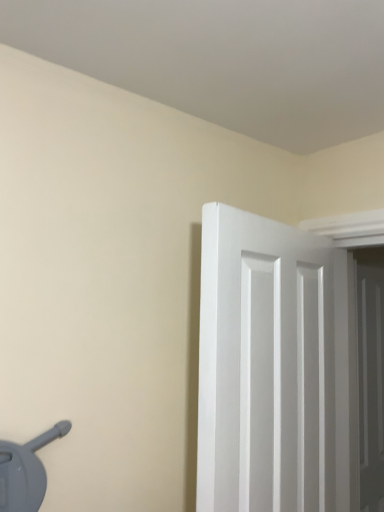
Question: Does white wooden door at right, acting as the 2th door starting from the left, have a smaller size compared to white smooth door at right, the second door viewed from the right?

Choices:
 (A) yes
 (B) no

Answer: (A)

Question: Is white wooden door at right, positioned as the first door in back-to-front order, completely or partially outside of white smooth door at right, which is the first door from left to right?

Choices:
 (A) yes
 (B) no

Answer: (A)

Question: Can you see white wooden door at right, acting as the 2th door starting from the left, touching white smooth door at right, the first door from the front?

Choices:
 (A) no
 (B) yes

Answer: (A)

Question: Can you confirm if white wooden door at right, the first door from the right, is thinner than white smooth door at right, which is the first door from left to right?

Choices:
 (A) no
 (B) yes

Answer: (B)

Question: From a real-world perspective, is white wooden door at right, acting as the 2th door starting from the left, on top of white smooth door at right, the first door from the front?

Choices:
 (A) yes
 (B) no

Answer: (B)

Question: Is white wooden door at right, positioned as the first door in back-to-front order, further to the viewer compared to white smooth door at right, the second door in the back-to-front sequence?

Choices:
 (A) yes
 (B) no

Answer: (A)

Question: Is white smooth door at right, the second door viewed from the right, facing away from white wooden door at right, positioned as the first door in back-to-front order?

Choices:
 (A) yes
 (B) no

Answer: (B)

Question: From a real-world perspective, is white smooth door at right, the second door viewed from the right, physically below white wooden door at right, positioned as the first door in back-to-front order?

Choices:
 (A) yes
 (B) no

Answer: (B)

Question: Considering the relative sizes of white smooth door at right, the second door in the back-to-front sequence, and white wooden door at right, which is the 2th door in front-to-back order, in the image provided, is white smooth door at right, the second door in the back-to-front sequence, bigger than white wooden door at right, which is the 2th door in front-to-back order,?

Choices:
 (A) no
 (B) yes

Answer: (B)

Question: From a real-world perspective, is white smooth door at right, the second door viewed from the right, physically above white wooden door at right, positioned as the first door in back-to-front order?

Choices:
 (A) no
 (B) yes

Answer: (B)

Question: Is white smooth door at right, the first door from the front, positioned behind white wooden door at right, which is the 2th door in front-to-back order?

Choices:
 (A) no
 (B) yes

Answer: (A)

Question: Considering the relative sizes of white smooth door at right, the first door from the front, and white wooden door at right, positioned as the first door in back-to-front order, in the image provided, is white smooth door at right, the first door from the front, shorter than white wooden door at right, positioned as the first door in back-to-front order,?

Choices:
 (A) yes
 (B) no

Answer: (A)

Question: From a real-world perspective, is white wooden door at right, acting as the 2th door starting from the left, above or below white smooth door at right, the first door from the front?

Choices:
 (A) above
 (B) below

Answer: (B)